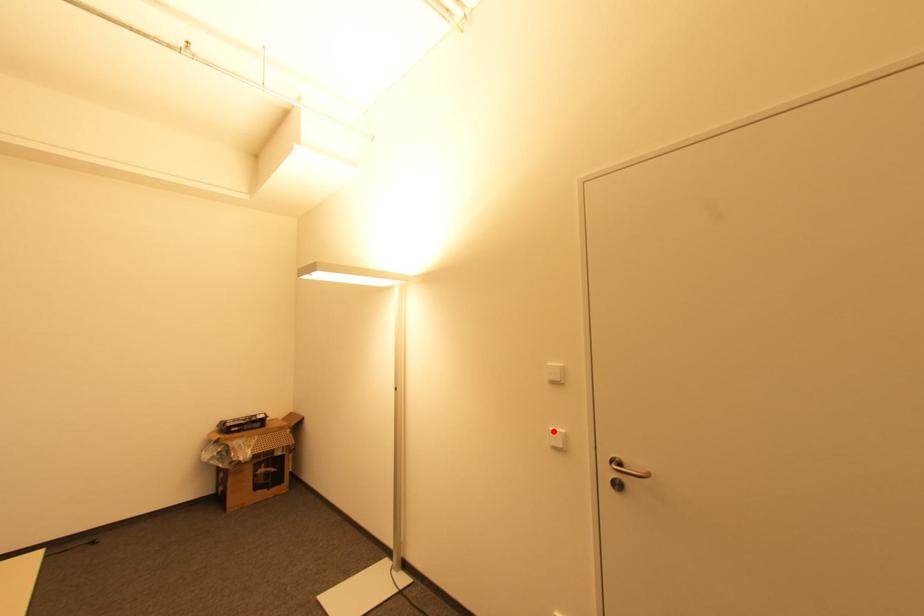
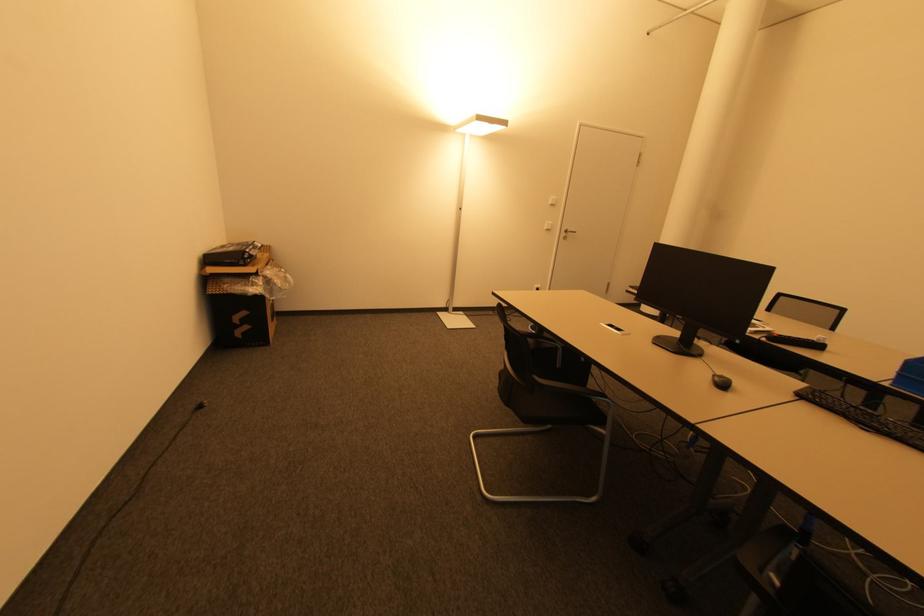
Where in the second image is the point corresponding to the highlighted location from the first image?

(550, 224)